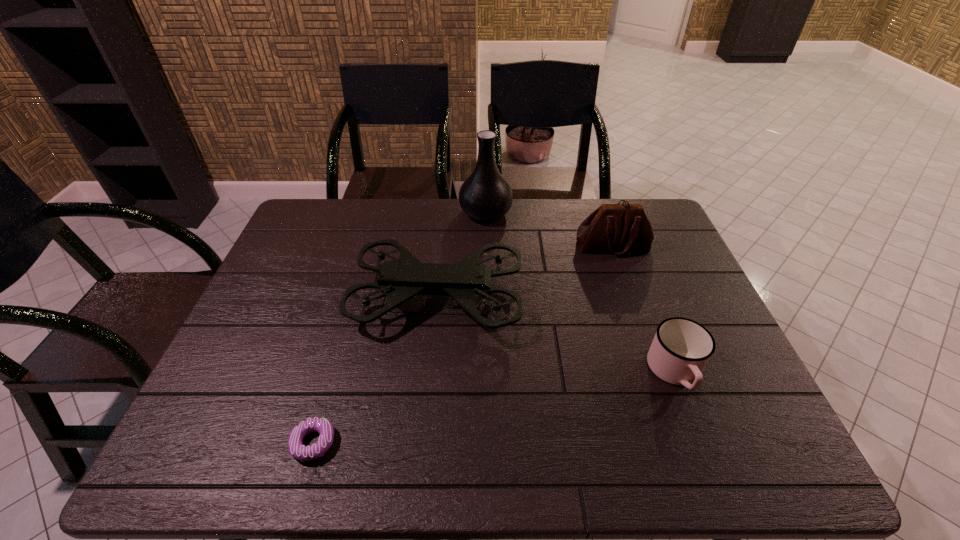
Locate an element on the screen. Image resolution: width=960 pixels, height=540 pixels. free point at the near edge is located at coordinates (702, 451).

In the image, there is a desktop. Identify the location of vacant space at the right edge. This screenshot has height=540, width=960. (642, 262).

This screenshot has width=960, height=540. I want to click on vacant area at the near right corner, so click(706, 447).

Where is `vacant space in between the mug and the vase`? vacant space in between the mug and the vase is located at coordinates (581, 292).

The width and height of the screenshot is (960, 540). Identify the location of vacant space that's between the doughnut and the mug. (494, 408).

Where is `unoccupied position between the fourth nearest object and the second shortest object`? This screenshot has height=540, width=960. unoccupied position between the fourth nearest object and the second shortest object is located at coordinates (644, 309).

Identify the location of free space between the fourth tallest object and the shoulder bag. (644, 309).

The height and width of the screenshot is (540, 960). In order to click on blank region between the second tallest object and the shortest object in this screenshot , I will do `click(375, 371)`.

This screenshot has width=960, height=540. I want to click on vacant area that lies between the shoulder bag and the drone, so click(525, 273).

At what (x,y) coordinates should I click in order to perform the action: click on free area in between the tallest object and the drone. Please return your answer as a coordinate pair (x, y). This screenshot has width=960, height=540. Looking at the image, I should click on (462, 255).